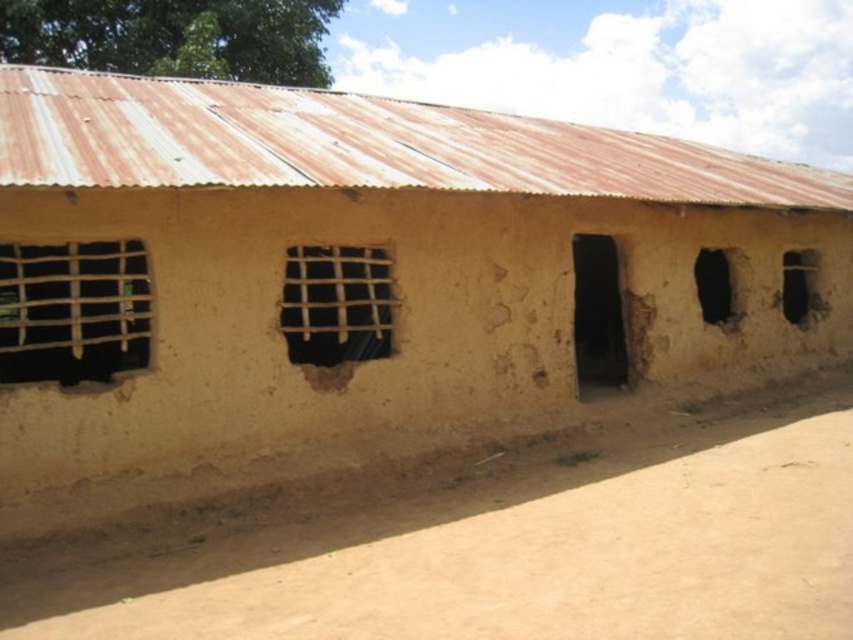
You are a delivery person carrying a package that requires a 5 meter clearance to pass through. You need to deliver it to the building shown. Can you pass through the space between the brown rough mud at center and the black matte door at center?

The brown rough mud at center and black matte door at center are 7.64 meters apart from each other, so yes, the delivery person can pass through the space between them since the distance is greater than the required 5 meter clearance.